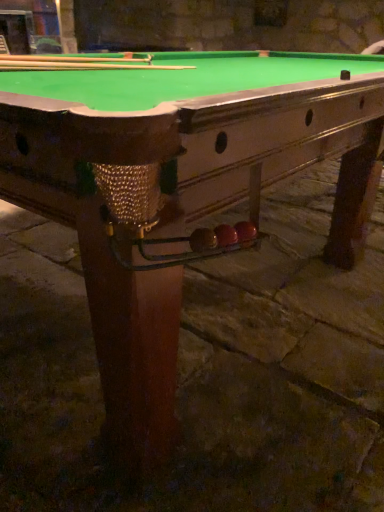
At what (x,y) coordinates should I click in order to perform the action: click on free location in front of wooden cue at upper center, marked as the first cue in a front-to-back arrangement. Please return your answer as a coordinate pair (x, y). Looking at the image, I should click on (98, 61).